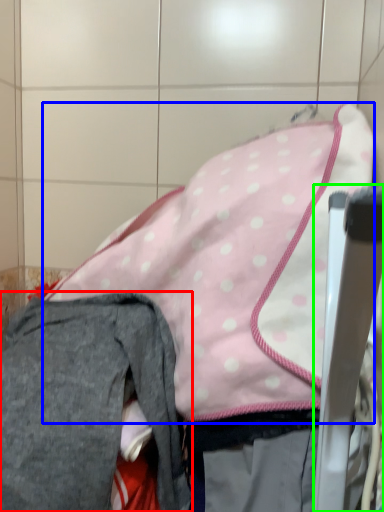
Question: Which object is positioned closest to trousers (highlighted by a red box)? Select from wide (highlighted by a blue box) and chair (highlighted by a green box).

Choices:
 (A) wide
 (B) chair

Answer: (A)